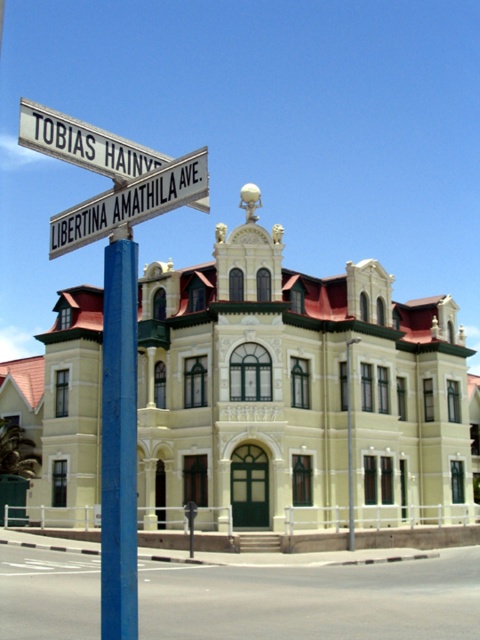
Can you confirm if blue painted metal pole at center is positioned to the right of white plastic street sign at upper center?

Correct, you'll find blue painted metal pole at center to the right of white plastic street sign at upper center.

Who is taller, blue painted metal pole at center or white plastic street sign at upper center?

Standing taller between the two is white plastic street sign at upper center.

I want to click on blue painted metal pole at center, so click(x=119, y=440).

I want to click on blue painted metal pole at center, so click(119, 440).